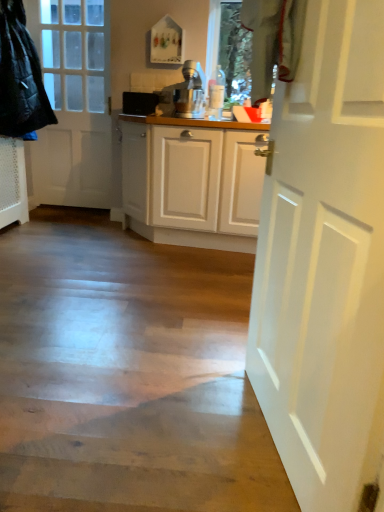
Question: Is white matte door at left, the first door in the top-to-bottom sequence, at the right side of black plastic speaker at center?

Choices:
 (A) yes
 (B) no

Answer: (B)

Question: Is white matte door at left, the first door when ordered from back to front, taller than black plastic speaker at center?

Choices:
 (A) no
 (B) yes

Answer: (B)

Question: From a real-world perspective, is white matte door at left, the first door in the top-to-bottom sequence, under black plastic speaker at center?

Choices:
 (A) yes
 (B) no

Answer: (A)

Question: Does white matte door at left, placed as the second door when sorted from right to left, have a greater width compared to black plastic speaker at center?

Choices:
 (A) no
 (B) yes

Answer: (B)

Question: Is white matte door at left, which is counted as the second door, starting from the front, turned away from black plastic speaker at center?

Choices:
 (A) yes
 (B) no

Answer: (B)

Question: Can you confirm if white matte door at left, the first door viewed from the left, is positioned to the left of black plastic speaker at center?

Choices:
 (A) no
 (B) yes

Answer: (B)

Question: Is white matte door at left, the first door when ordered from back to front, facing towards quilted black jacket at left?

Choices:
 (A) no
 (B) yes

Answer: (B)

Question: From a real-world perspective, is white matte door at left, the first door viewed from the left, under quilted black jacket at left?

Choices:
 (A) no
 (B) yes

Answer: (B)

Question: Is the depth of white matte door at left, the first door when ordered from back to front, less than that of quilted black jacket at left?

Choices:
 (A) yes
 (B) no

Answer: (B)

Question: Would you say white matte door at left, which is counted as the second door, starting from the front, is outside quilted black jacket at left?

Choices:
 (A) yes
 (B) no

Answer: (A)

Question: Does white matte door at left, the first door viewed from the left, have a lesser height compared to quilted black jacket at left?

Choices:
 (A) yes
 (B) no

Answer: (B)

Question: Is white matte door at left, the first door when ordered from back to front, positioned behind quilted black jacket at left?

Choices:
 (A) yes
 (B) no

Answer: (A)

Question: Is white matte door at right, which is the second door from back to front, positioned in front of white matte door at left, the first door viewed from the left?

Choices:
 (A) yes
 (B) no

Answer: (A)